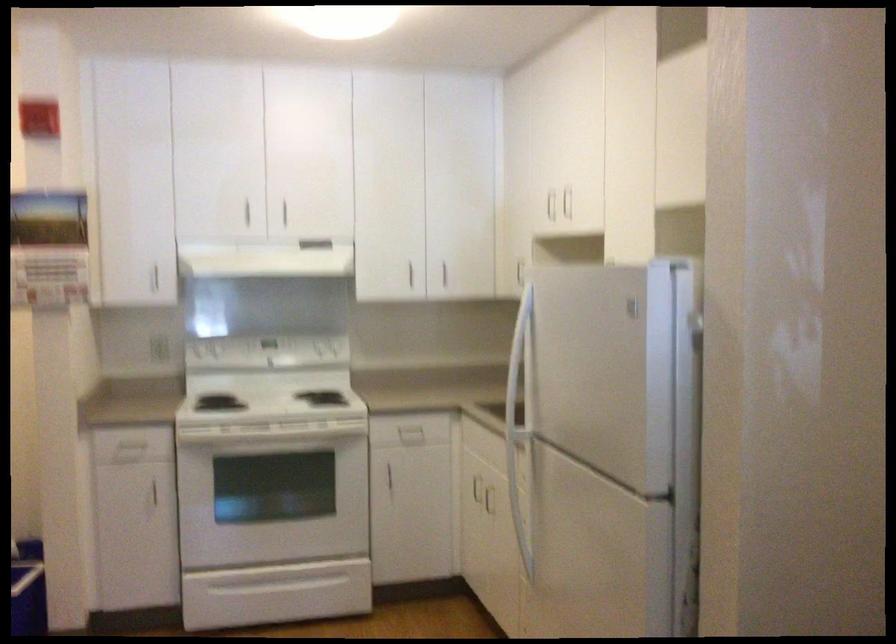
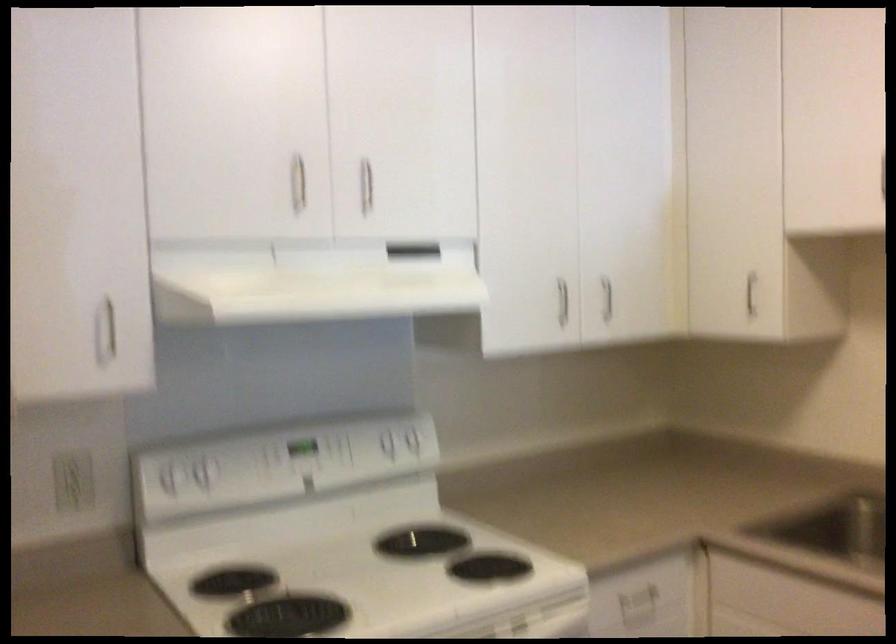
Find the pixel in the second image that matches the point at 336,346 in the first image.

(419, 444)